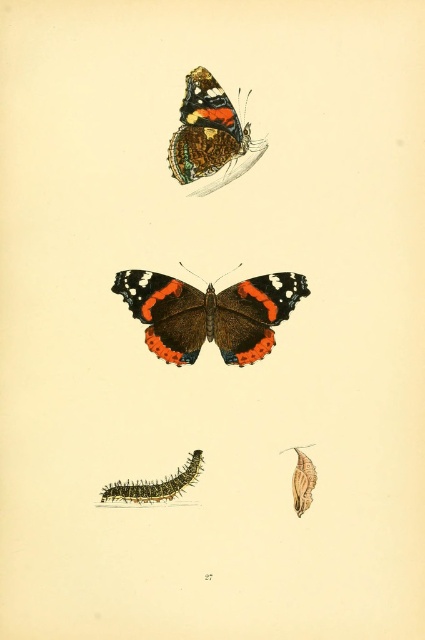
You are a student examining a natural history book. You see the matte orange butterfly at upper center and the fuzzy brown caterpillar at lower left. Which of these two has a larger height?

The matte orange butterfly at upper center has a greater height compared to the fuzzy brown caterpillar at lower left.

You are standing at a point 4.46 feet away from the point labeled point (x=186, y=115). If you want to move closer to that point, which direction should you move?

Since you are 4.46 feet away from the point labeled point (x=186, y=115), you should move towards that point to get closer.

You are an entomologist examining the illustration in the book. You notice two butterflies, the shiny brown butterfly at center and the matte orange butterfly at upper center. Which of these two butterflies is smaller in size?

The shiny brown butterfly at center has a smaller size compared to the matte orange butterfly at upper center, so the shiny brown butterfly at center is the smaller one.